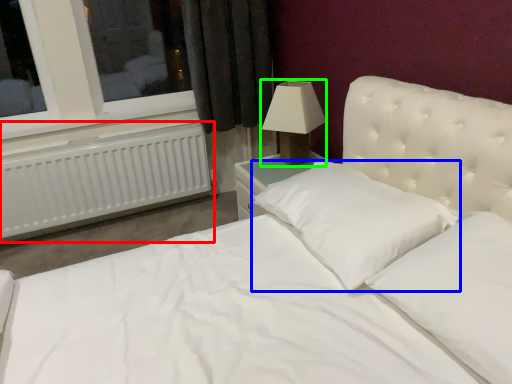
Question: Based on their relative distances, which object is farther from radiator (highlighted by a red box)? Choose from pillow (highlighted by a blue box) and lamp (highlighted by a green box).

Choices:
 (A) pillow
 (B) lamp

Answer: (A)